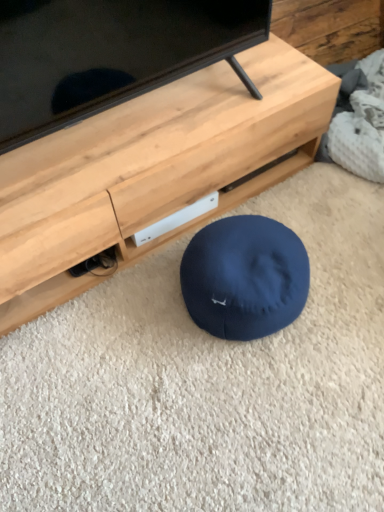
Question: Relative to matte black tv at center, is matte wood tv stand at center in front or behind?

Choices:
 (A) behind
 (B) front

Answer: (A)

Question: Considering the positions of point (286, 72) and point (233, 28), is point (286, 72) closer or farther from the camera than point (233, 28)?

Choices:
 (A) closer
 (B) farther

Answer: (B)

Question: Based on their sizes in the image, would you say matte wood tv stand at center is bigger or smaller than matte black tv at center?

Choices:
 (A) big
 (B) small

Answer: (A)

Question: From the image's perspective, relative to matte wood tv stand at center, is matte black tv at center above or below?

Choices:
 (A) below
 (B) above

Answer: (B)

Question: In the image, is matte black tv at center positioned in front of or behind matte wood tv stand at center?

Choices:
 (A) front
 (B) behind

Answer: (A)

Question: Does point (66, 101) appear closer or farther from the camera than point (109, 164)?

Choices:
 (A) farther
 (B) closer

Answer: (B)

Question: Based on their sizes in the image, would you say matte black tv at center is bigger or smaller than matte wood tv stand at center?

Choices:
 (A) big
 (B) small

Answer: (B)